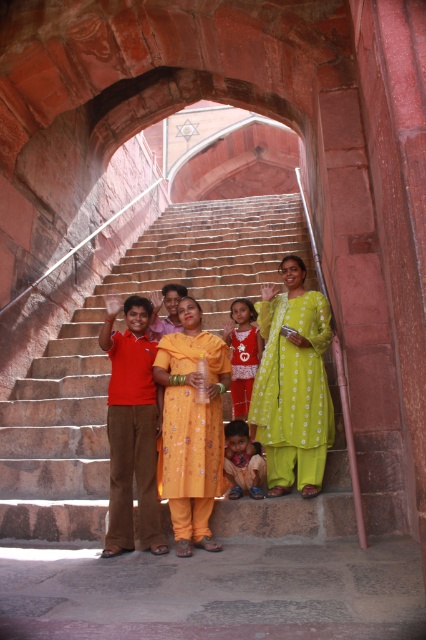
Question: Which object is closer to the camera taking this photo?

Choices:
 (A) lime green fabric at center
 (B) yellow cotton dress at center
 (C) light brown fabric at lower center

Answer: (B)

Question: Among these objects, which one is farthest from the camera?

Choices:
 (A) yellow embroidered dress at center
 (B) matte pink dress at center
 (C) yellow cotton dress at center
 (D) light brown fabric at lower center

Answer: (B)

Question: Is yellow cotton dress at center thinner than light brown fabric at lower center?

Choices:
 (A) yes
 (B) no

Answer: (B)

Question: Is yellow cotton dress at center bigger than light brown fabric at lower center?

Choices:
 (A) no
 (B) yes

Answer: (B)

Question: Which of the following is the closest to the observer?

Choices:
 (A) (253, 353)
 (B) (176, 541)
 (C) (314, 362)

Answer: (B)

Question: Does yellow embroidered dress at center appear on the right side of matte pink dress at center?

Choices:
 (A) yes
 (B) no

Answer: (B)